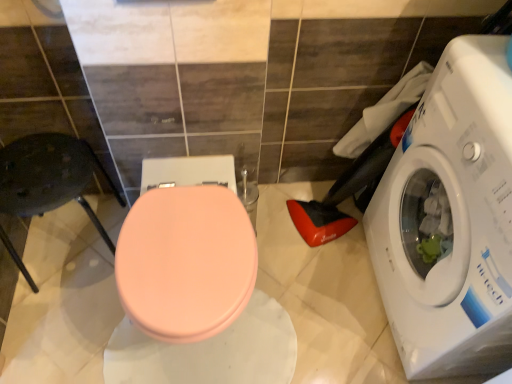
Question: In terms of width, does white glossy washing machine at right look wider or thinner when compared to matte pink lid at center?

Choices:
 (A) wide
 (B) thin

Answer: (B)

Question: From the image's perspective, relative to matte pink lid at center, is white glossy washing machine at right above or below?

Choices:
 (A) below
 (B) above

Answer: (B)

Question: Estimate the real-world distances between objects in this image. Which object is farther from the matte pink lid at center?

Choices:
 (A) white glossy washing machine at right
 (B) metallic dark gray chair at left

Answer: (A)

Question: Which is nearer to the metallic dark gray chair at left?

Choices:
 (A) white glossy washing machine at right
 (B) matte pink lid at center

Answer: (B)